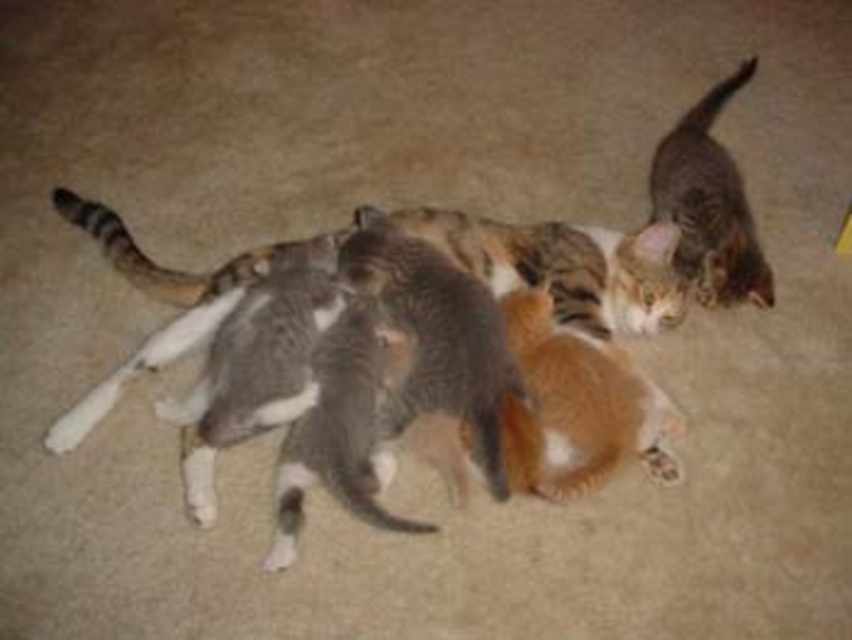
Question: Which of the following is the closest to the observer?

Choices:
 (A) gray fur cat at center
 (B) tabby fur cat at upper right

Answer: (A)

Question: Does gray fur cat at center appear on the left side of tabby fur cat at upper right?

Choices:
 (A) no
 (B) yes

Answer: (B)

Question: Can you confirm if gray fur cat at center is smaller than tabby fur cat at upper right?

Choices:
 (A) no
 (B) yes

Answer: (A)

Question: Is gray fur cat at center positioned behind tabby fur cat at upper right?

Choices:
 (A) no
 (B) yes

Answer: (A)